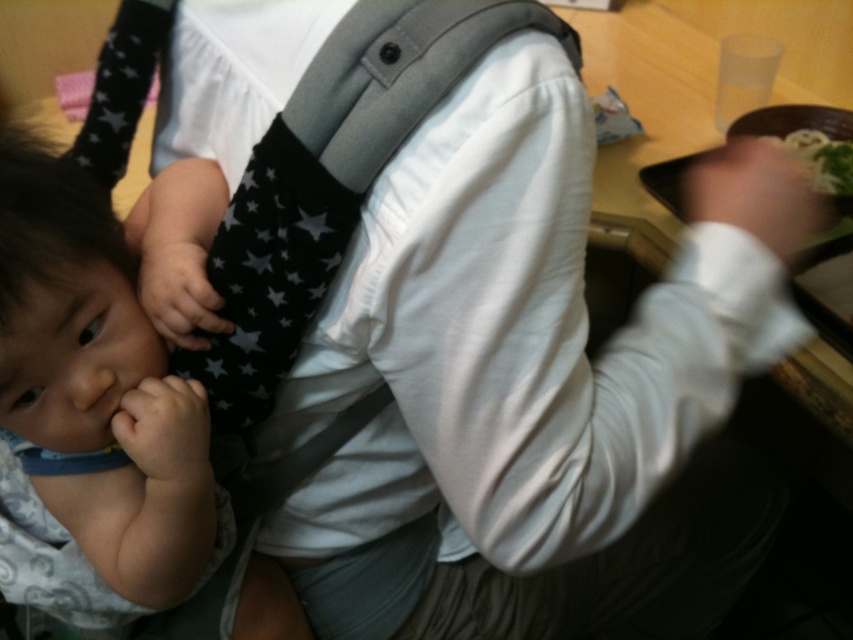
Question: Which object is farther from the camera taking this photo?

Choices:
 (A) white noodles at upper right
 (B) black star-patterned carrier at center

Answer: (A)

Question: Which object appears farthest from the camera in this image?

Choices:
 (A) soft white baby at center
 (B) black star-patterned carrier at center
 (C) white noodles at upper right

Answer: (C)

Question: Does soft white baby at center have a lesser width compared to black star-patterned carrier at center?

Choices:
 (A) no
 (B) yes

Answer: (B)

Question: Which object is closer to the camera taking this photo?

Choices:
 (A) white noodles at upper right
 (B) black star-patterned carrier at center

Answer: (B)

Question: Does soft white baby at center have a smaller size compared to black star-patterned carrier at center?

Choices:
 (A) no
 (B) yes

Answer: (B)

Question: Is black star-patterned carrier at center wider than white noodles at upper right?

Choices:
 (A) no
 (B) yes

Answer: (B)